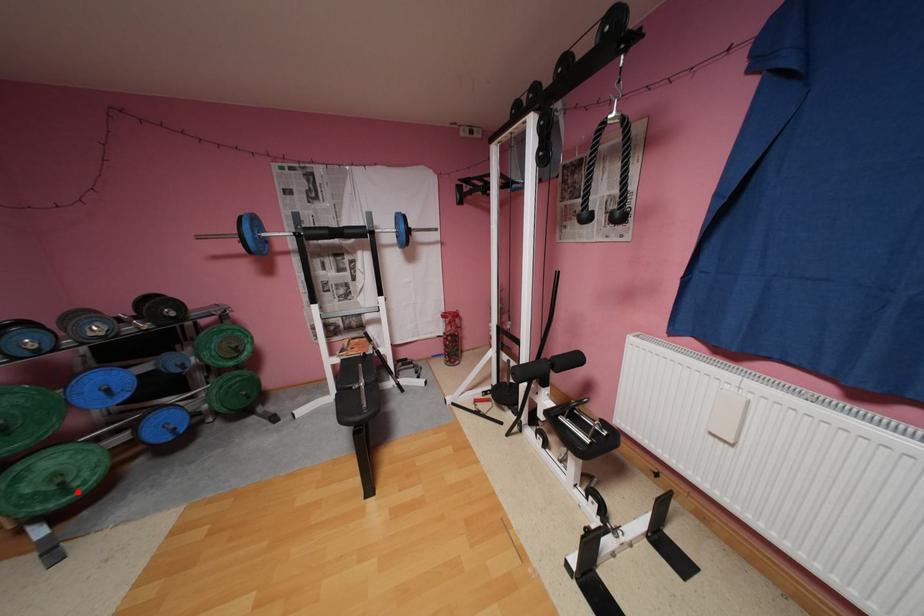
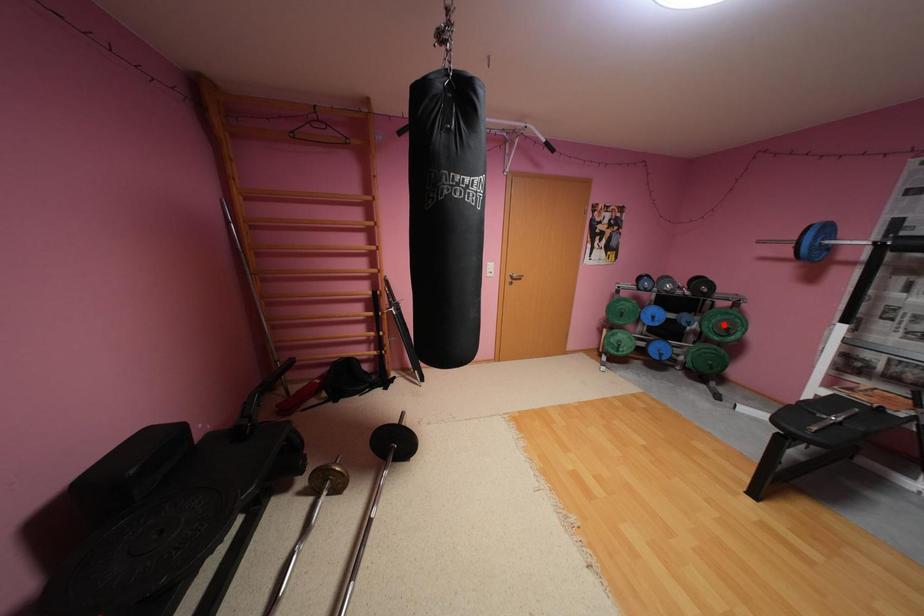
I am providing you with two images of the same scene from different viewpoints. A red point is marked on the first image and another point is marked on the second image. Is the red point in image1 aligned with the point shown in image2?

No